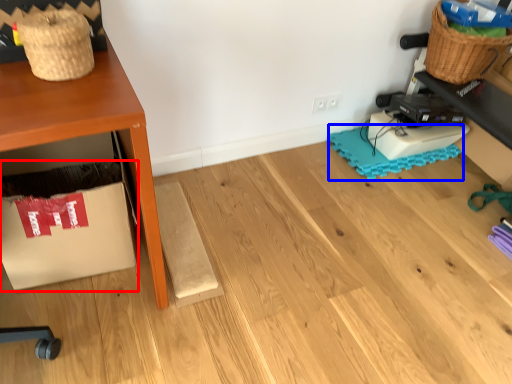
Question: Which object is further to the camera taking this photo, cardboard box (highlighted by a red box) or mat (highlighted by a blue box)?

Choices:
 (A) cardboard box
 (B) mat

Answer: (B)